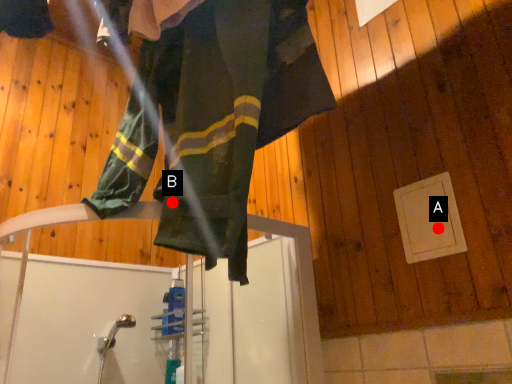
Question: Two points are circled on the image, labeled by A and B beside each circle. Which of the following is the closest to the observer?

Choices:
 (A) A is closer
 (B) B is closer

Answer: (B)